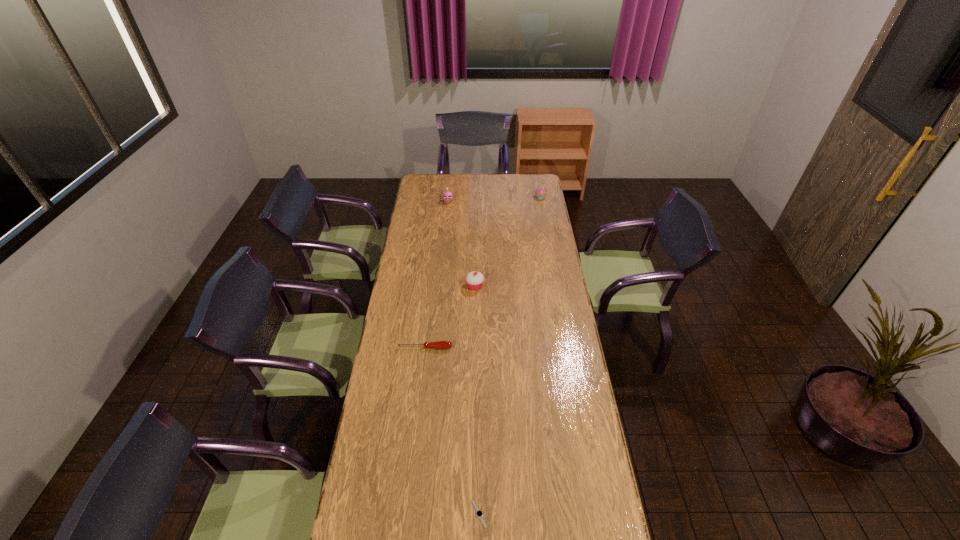
The width and height of the screenshot is (960, 540). Find the location of `free spot located 0.140m on the front of the second cupcake from right to left`. free spot located 0.140m on the front of the second cupcake from right to left is located at coordinates (474, 315).

Where is `free location located 0.240m on the right of the second shortest object`? The image size is (960, 540). free location located 0.240m on the right of the second shortest object is located at coordinates (508, 348).

Find the location of a particular element. This screenshot has width=960, height=540. vacant position located on the right of the watch is located at coordinates (609, 514).

I want to click on object that is at the left edge, so click(439, 344).

You are a GUI agent. You are given a task and a screenshot of the screen. Output one action in this format:
    pyautogui.click(x=<x>, y=<y>)
    Task: Click on the object at the right edge
    The image size is (960, 540).
    Given the screenshot: What is the action you would take?
    coord(540,192)

In the image, there is a desktop. At what (x,y) coordinates should I click in order to perform the action: click on vacant space at the far edge. Please return your answer as a coordinate pair (x, y). The image size is (960, 540). Looking at the image, I should click on (449, 180).

In the image, there is a desktop. Where is `vacant space at the left edge`? This screenshot has width=960, height=540. vacant space at the left edge is located at coordinates (440, 199).

Locate an element on the screen. vacant space at the right edge is located at coordinates (546, 243).

Where is `vacant area that lies between the screwdriver and the nearest object`? vacant area that lies between the screwdriver and the nearest object is located at coordinates (452, 431).

Where is `vacant area between the fourth farthest object and the leftmost cupcake`? vacant area between the fourth farthest object and the leftmost cupcake is located at coordinates (437, 275).